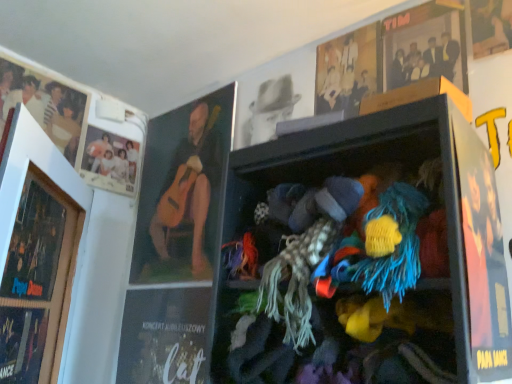
Question: Is wooden picture frame at left bigger or smaller than light brown wooden frame at upper center, which is counted as the 1th person, starting from the right?

Choices:
 (A) big
 (B) small

Answer: (A)

Question: Is wooden picture frame at left to the left or to the right of light brown wooden frame at upper center, which ranks as the fourth person in left-to-right order, in the image?

Choices:
 (A) left
 (B) right

Answer: (A)

Question: Estimate the real-world distances between objects in this image. Which object is farther from the matte black photo frame at upper left, which is the first person in left-to-right order?

Choices:
 (A) black paper magazine at lower left, placed as the 2th magazine when sorted from front to back
 (B) matte white photo at upper left, the second person from the left
 (C) wooden picture frame at left
 (D) matte black poster at right
 (E) matte black magazine at lower left, which is the first magazine from left to right

Answer: (D)

Question: Which of these objects is positioned closest to the matte white photo at upper left, the second person from the left?

Choices:
 (A) light brown wooden frame at upper center, which ranks as the fourth person in left-to-right order
 (B) matte black photo frame at upper left, which is the first person in left-to-right order
 (C) matte black magazine at lower left, which is the first magazine from left to right
 (D) oil-painted guitar at upper left, which is the 3th person in left-to-right order
 (E) matte black poster at right

Answer: (B)